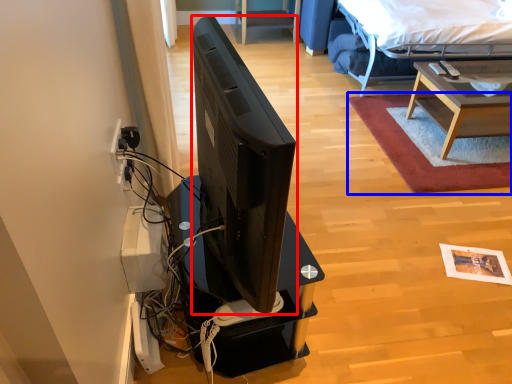
Question: Which of the following is the closest to the observer, television (highlighted by a red box) or plain (highlighted by a blue box)?

Choices:
 (A) television
 (B) plain

Answer: (A)